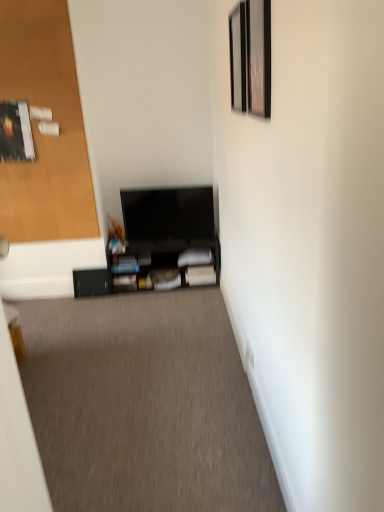
Question: Is wooden door at left to the left of matte black shelf at center, arranged as the 2th shelf when viewed from the left, from the viewer's perspective?

Choices:
 (A) no
 (B) yes

Answer: (B)

Question: Does wooden door at left have a lesser width compared to matte black shelf at center, arranged as the 2th shelf when viewed from the left?

Choices:
 (A) no
 (B) yes

Answer: (B)

Question: Is wooden door at left not near matte black shelf at center, arranged as the 2th shelf when viewed from the left?

Choices:
 (A) yes
 (B) no

Answer: (B)

Question: Is wooden door at left not within matte black shelf at center, arranged as the 2th shelf when viewed from the left?

Choices:
 (A) yes
 (B) no

Answer: (A)

Question: Is wooden door at left oriented away from matte black shelf at center, which is the 1th shelf in right-to-left order?

Choices:
 (A) no
 (B) yes

Answer: (A)

Question: Considering the relative positions of wooden door at left and matte black shelf at center, which is the 1th shelf in right-to-left order, in the image provided, is wooden door at left behind matte black shelf at center, which is the 1th shelf in right-to-left order,?

Choices:
 (A) no
 (B) yes

Answer: (A)

Question: Is the depth of wooden picture frame at upper right, the 1th picture frame in the back-to-front sequence, less than that of black matte tv at center?

Choices:
 (A) yes
 (B) no

Answer: (B)

Question: From a real-world perspective, is wooden picture frame at upper right, the 1th picture frame in the back-to-front sequence, physically below black matte tv at center?

Choices:
 (A) no
 (B) yes

Answer: (A)

Question: Considering the relative sizes of wooden picture frame at upper right, placed as the 2th picture frame when sorted from front to back, and black matte tv at center in the image provided, is wooden picture frame at upper right, placed as the 2th picture frame when sorted from front to back, taller than black matte tv at center?

Choices:
 (A) no
 (B) yes

Answer: (B)

Question: Does wooden picture frame at upper right, the 1th picture frame in the back-to-front sequence, have a lesser width compared to black matte tv at center?

Choices:
 (A) yes
 (B) no

Answer: (A)

Question: From the image's perspective, is wooden picture frame at upper right, the 1th picture frame in the back-to-front sequence, beneath black matte tv at center?

Choices:
 (A) no
 (B) yes

Answer: (A)

Question: From a real-world perspective, is wooden picture frame at upper right, the 1th picture frame in the back-to-front sequence, positioned over black matte tv at center based on gravity?

Choices:
 (A) no
 (B) yes

Answer: (B)

Question: Is metallic silver picture frame at upper right, acting as the 1th picture frame starting from the front, at the back of black matte tv at center?

Choices:
 (A) no
 (B) yes

Answer: (A)